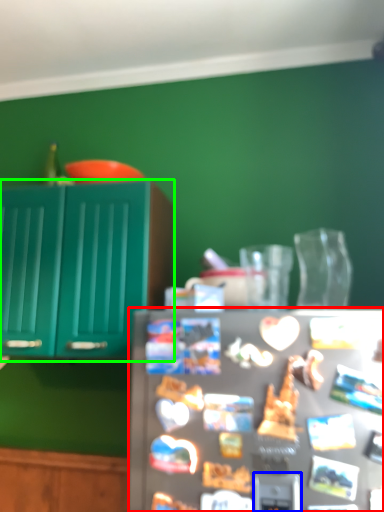
Question: Based on their relative distances, which object is farther from refrigerator (highlighted by a red box)? Choose from appliance (highlighted by a blue box) and cabinetry (highlighted by a green box).

Choices:
 (A) appliance
 (B) cabinetry

Answer: (B)